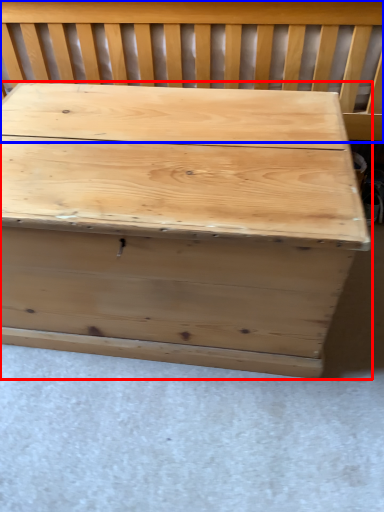
Question: Which object appears closest to the camera in this image, table (highlighted by a red box) or church bench (highlighted by a blue box)?

Choices:
 (A) table
 (B) church bench

Answer: (A)